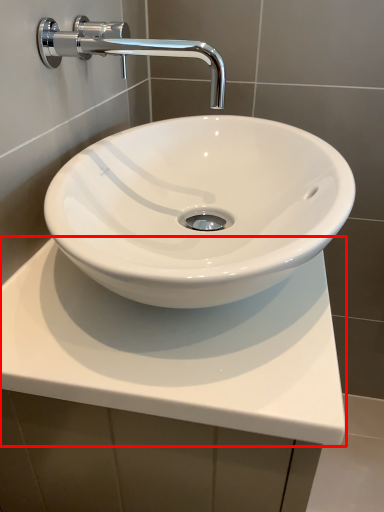
Question: From the image's perspective, what is the correct spatial positioning of counter top (annotated by the red box) in reference to tap?

Choices:
 (A) above
 (B) below

Answer: (B)